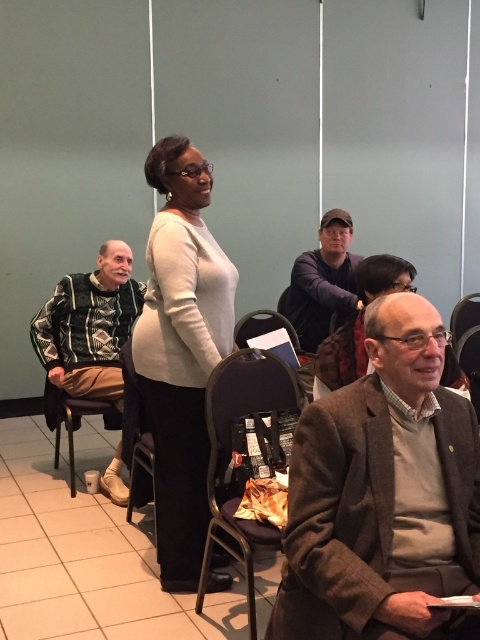
Is white matte sweater at center thinner than matte white shirt at center?

In fact, white matte sweater at center might be wider than matte white shirt at center.

Can you confirm if white matte sweater at center is shorter than matte white shirt at center?

Incorrect, white matte sweater at center's height does not fall short of matte white shirt at center's.

Does point (158, 168) lie behind point (455, 360)?

That is False.

At what (x,y) coordinates should I click in order to perform the action: click on white matte sweater at center. Please return your answer as a coordinate pair (x, y). Image resolution: width=480 pixels, height=640 pixels. Looking at the image, I should click on (181, 349).

Can you confirm if brown woolen jacket at lower right is wider than black fabric chair at center?

Indeed, brown woolen jacket at lower right has a greater width compared to black fabric chair at center.

Which is above, brown woolen jacket at lower right or black fabric chair at center?

Positioned higher is brown woolen jacket at lower right.

Measure the distance between point (403, 346) and camera.

Point (403, 346) is 1.55 meters away from camera.

The height and width of the screenshot is (640, 480). Find the location of `brown woolen jacket at lower right`. brown woolen jacket at lower right is located at coordinates (381, 492).

What do you see at coordinates (381, 492) in the screenshot? I see `brown woolen jacket at lower right` at bounding box center [381, 492].

Does brown woolen jacket at lower right have a larger size compared to dark blue sweater at center?

No.

Image resolution: width=480 pixels, height=640 pixels. What are the coordinates of `brown woolen jacket at lower right` in the screenshot? It's located at click(381, 492).